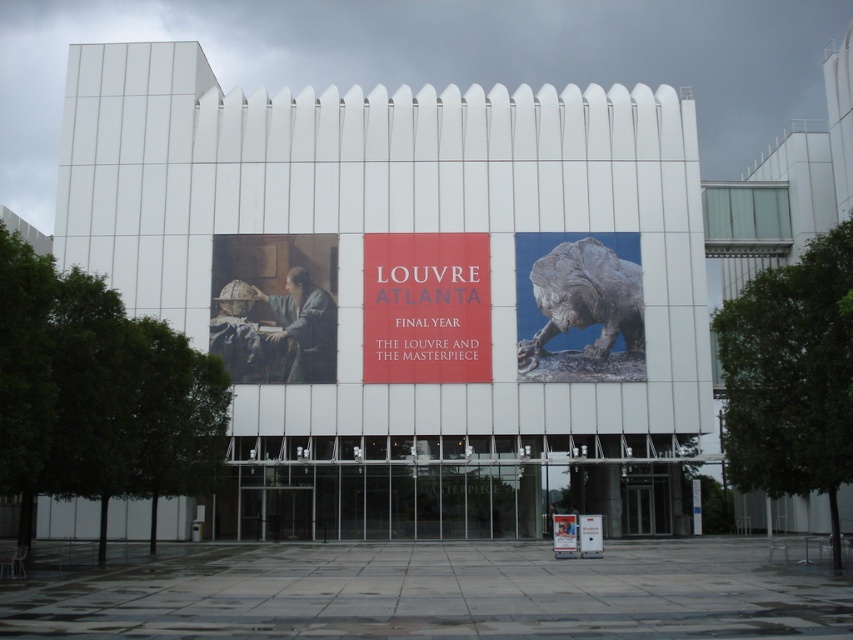
You are standing in front of the modern building with two points marked on its facade. The first point is at coordinates point (x=415, y=276) and the second is at point (x=541, y=282). Which of these points is closer to you?

Point (x=415, y=276) is in front of point (x=541, y=282), so the first point is closer to you.

You are a visitor approaching the building and see both the matte red sign at center and the matte white sign at center. Which one do you think is bigger?

The matte red sign at center is larger than the matte white sign at center.

You are standing in front of the modern building and want to locate the bronze statue at right. Which direction should you look relative to the matte red sign at center?

The bronze statue at right is to the right of the matte red sign at center, so you should look to the right of the matte red sign at center to find the bronze statue at right.